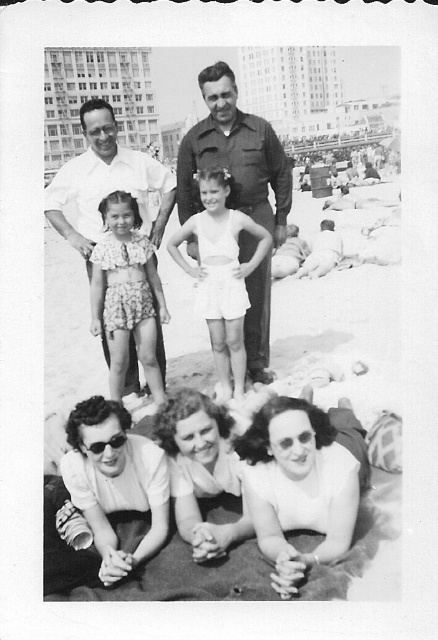
Based on the scene described, which object is taller between the white cotton shirt at upper left and the floral fabric swimsuit at center?

The white cotton shirt at upper left is taller than the floral fabric swimsuit at center.

You are a photographer trying to capture a candid shot of the floral fabric swimsuit at center without the white cotton shirt at upper left blocking the view. Is this possible given their positions?

The white cotton shirt at upper left is further to the viewer than the floral fabric swimsuit at center, so it will block the view. Move to the side to avoid the obstruction.

You are a photographer trying to capture a photo of the white cotton shirt at upper left and the matte white swimsuit at lower center. The camera you have can focus on objects within a 10 meter range. Will both subjects be in focus?

The matte white swimsuit at lower center is 16.89 meters from the white cotton shirt at upper left. Since the camera can only focus within 10 meters, the distance between them exceeds the focus range, so both subjects cannot be in focus simultaneously.